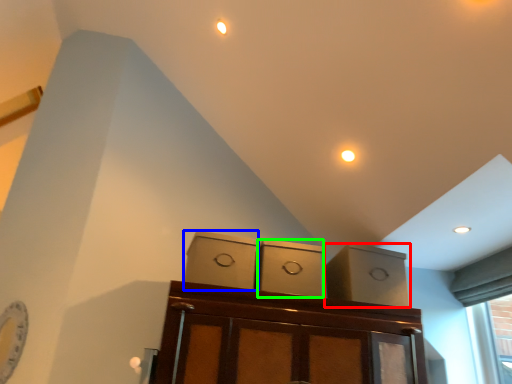
Question: Which object is positioned closest to cabinetry (highlighted by a red box)? Select from cabinetry (highlighted by a blue box) and cabinetry (highlighted by a green box).

Choices:
 (A) cabinetry
 (B) cabinetry

Answer: (B)